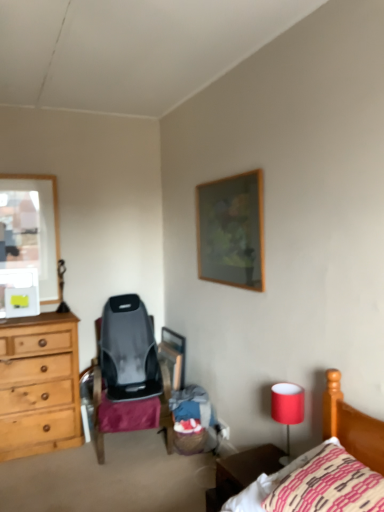
Question: Considering their positions, is knitted cotton pillow at lower right located in front of or behind wooden picture frame at upper center?

Choices:
 (A) front
 (B) behind

Answer: (A)

Question: Is knitted cotton pillow at lower right inside the boundaries of wooden picture frame at upper center, or outside?

Choices:
 (A) outside
 (B) inside

Answer: (A)

Question: Which of these objects is positioned farthest from the wooden picture frame at upper center?

Choices:
 (A) knitted cotton pillow at lower right
 (B) red fabric lampshade at lower right
 (C) brown wooden nightstand at lower right

Answer: (A)

Question: Which object is the closest to the brown wooden nightstand at lower right?

Choices:
 (A) knitted cotton pillow at lower right
 (B) wooden picture frame at upper center
 (C) red fabric lampshade at lower right

Answer: (C)